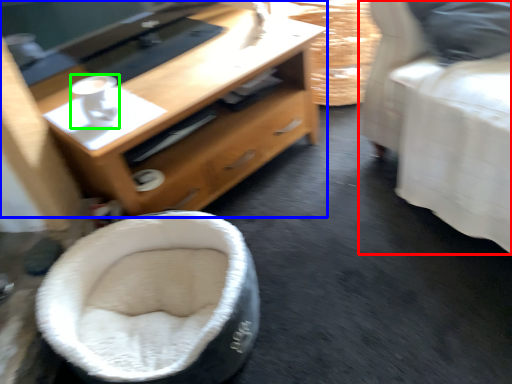
Question: Considering the real-world distances, which object is closest to furniture (highlighted by a red box)? desk (highlighted by a blue box) or coffee (highlighted by a green box).

Choices:
 (A) desk
 (B) coffee

Answer: (A)